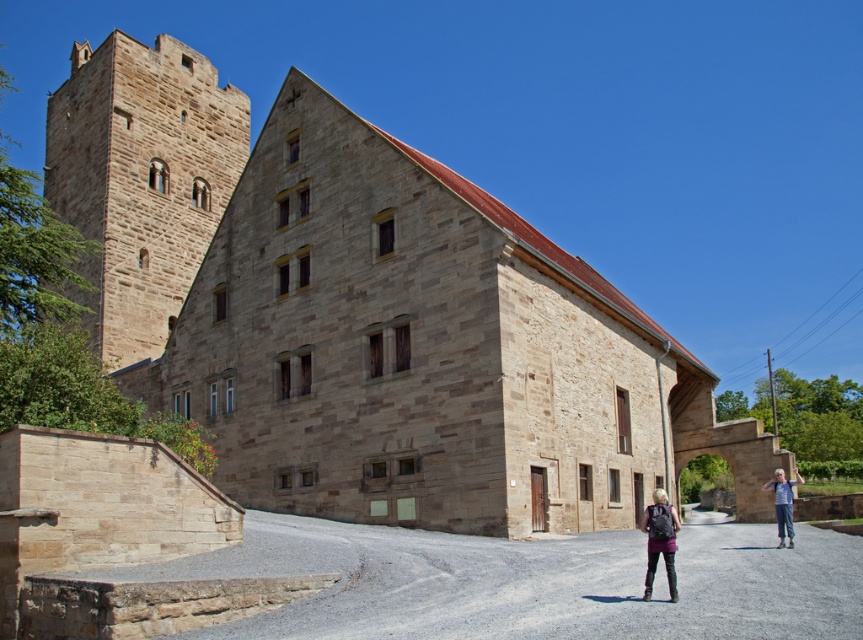
You are an architect assessing the structural integrity of the brown stone tower at upper left and the matte purple jacket at lower center. Which object is wider?

The brown stone tower at upper left is wider than the matte purple jacket at lower center according to the description.

You are a guest at this historic castle and need to locate your belongings. You remember placing a matte purple jacket at lower center and denim pants at lower right near the entrance. Which item is positioned closer to the left side of the entrance area?

The matte purple jacket at lower center is positioned to the left of the denim pants at lower right, so it is closer to the left side of the entrance area.